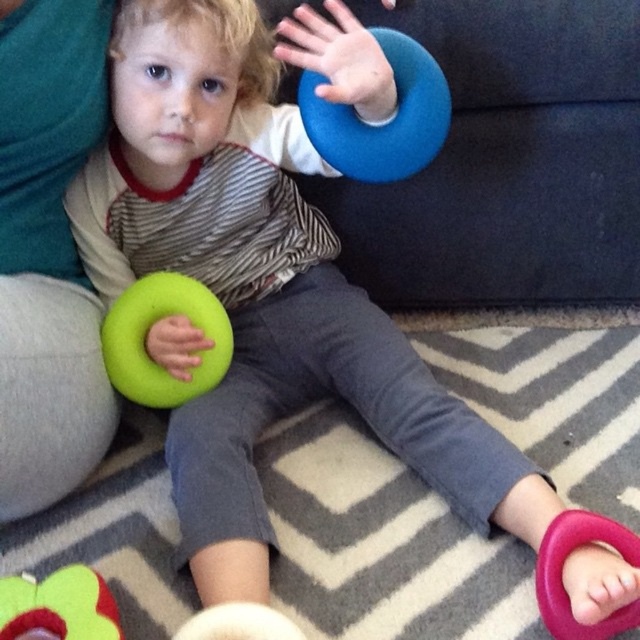
Question: In this image, where is green foam ring at lower left located relative to pink rubber ring at lower right?

Choices:
 (A) left
 (B) right

Answer: (A)

Question: Is blue rubber frisbee at upper center further to camera compared to soft plush flower at lower left?

Choices:
 (A) yes
 (B) no

Answer: (A)

Question: Which point is closer to the camera?

Choices:
 (A) (620, 632)
 (B) (182, 296)

Answer: (A)

Question: Which is farther from the soft plush flower at lower left?

Choices:
 (A) blue rubber frisbee at upper center
 (B) green foam ring at lower left

Answer: (A)

Question: Which point is farther to the camera?

Choices:
 (A) pink rubber ring at lower right
 (B) green foam ring at lower left

Answer: (B)

Question: Where is blue rubber frisbee at upper center located in relation to pink rubber ring at lower right in the image?

Choices:
 (A) left
 (B) right

Answer: (A)